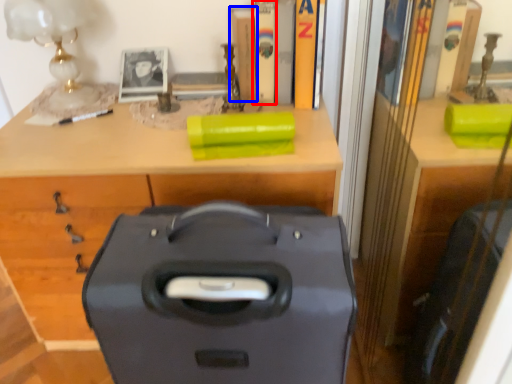
Question: Which object appears closest to the camera in this image, book (highlighted by a red box) or book (highlighted by a blue box)?

Choices:
 (A) book
 (B) book

Answer: (A)